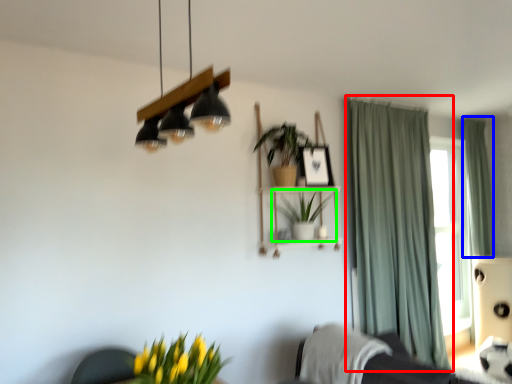
Question: Estimate the real-world distances between objects in this image. Which object is closer to curtain (highlighted by a red box), curtain (highlighted by a blue box) or houseplant (highlighted by a green box)?

Choices:
 (A) curtain
 (B) houseplant

Answer: (B)